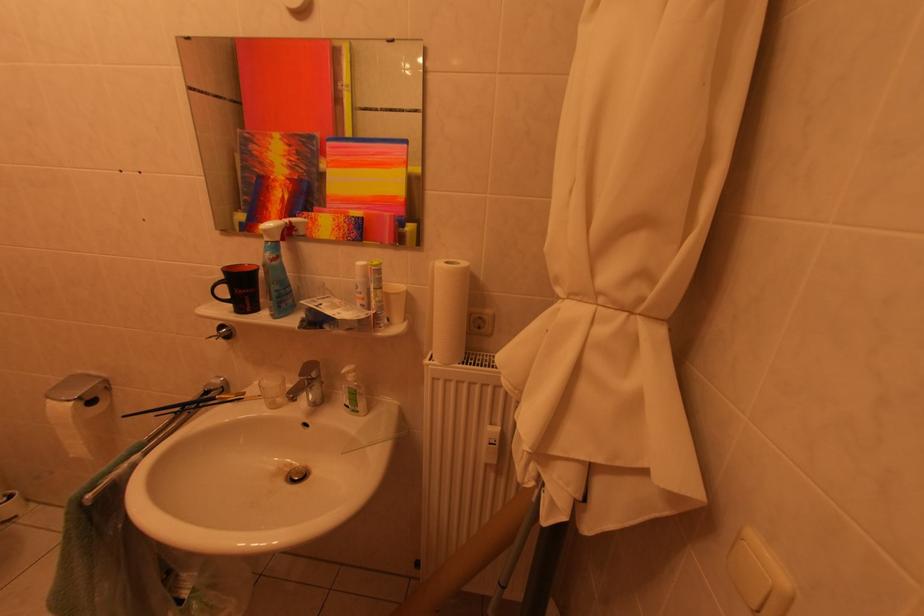
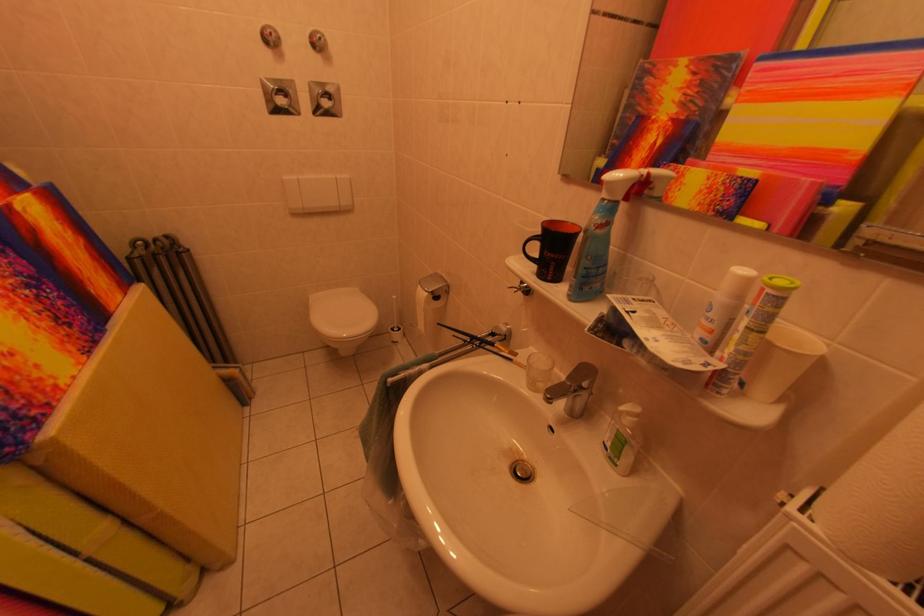
Where in the second image is the point corresponding to (309,379) from the first image?

(578, 382)